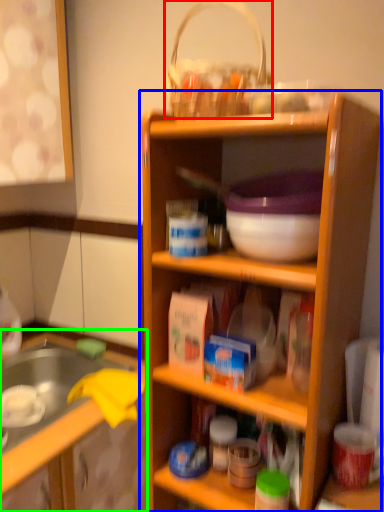
Question: Which object is the closest to the basket (highlighted by a red box)? Choose among these: shelf (highlighted by a blue box) or cabinetry (highlighted by a green box).

Choices:
 (A) shelf
 (B) cabinetry

Answer: (A)